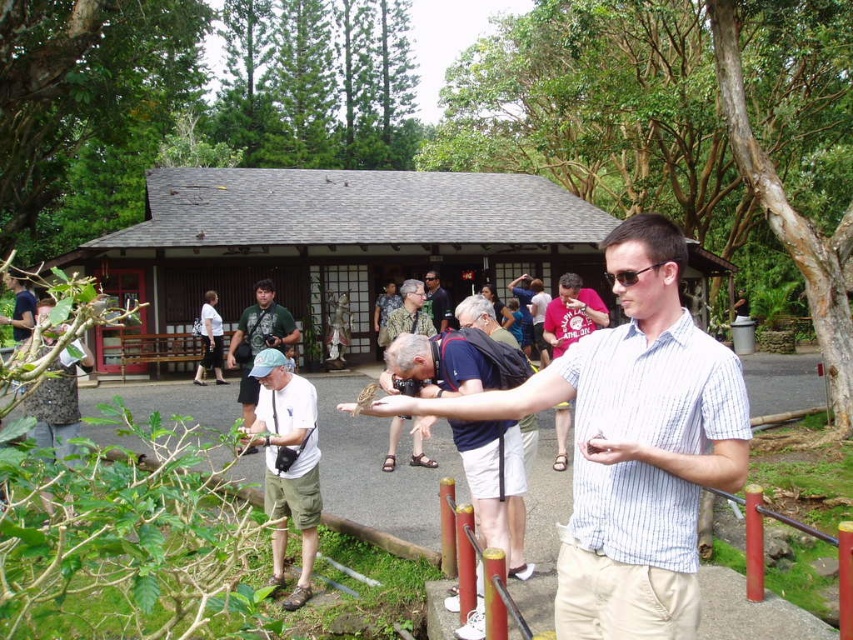
Question: Can you confirm if blue striped shirt at center is thinner than dark blue shirt at center?

Choices:
 (A) no
 (B) yes

Answer: (A)

Question: Can you confirm if white striped shirt at center is positioned to the left of matte khaki shorts at center?

Choices:
 (A) yes
 (B) no

Answer: (B)

Question: Based on their relative distances, which object is nearer to the matte khaki shorts at center?

Choices:
 (A) white cotton shirt at center
 (B) dark blue shirt at center

Answer: (A)

Question: From the image, what is the correct spatial relationship of white striped shirt at center in relation to blue striped shirt at center?

Choices:
 (A) above
 (B) below

Answer: (A)

Question: Which object appears closest to the camera in this image?

Choices:
 (A) white striped shirt at center
 (B) matte khaki shorts at center

Answer: (A)

Question: Which of the following is the closest to the observer?

Choices:
 (A) matte khaki shorts at center
 (B) white cotton shirt at center
 (C) dark blue shirt at center

Answer: (B)